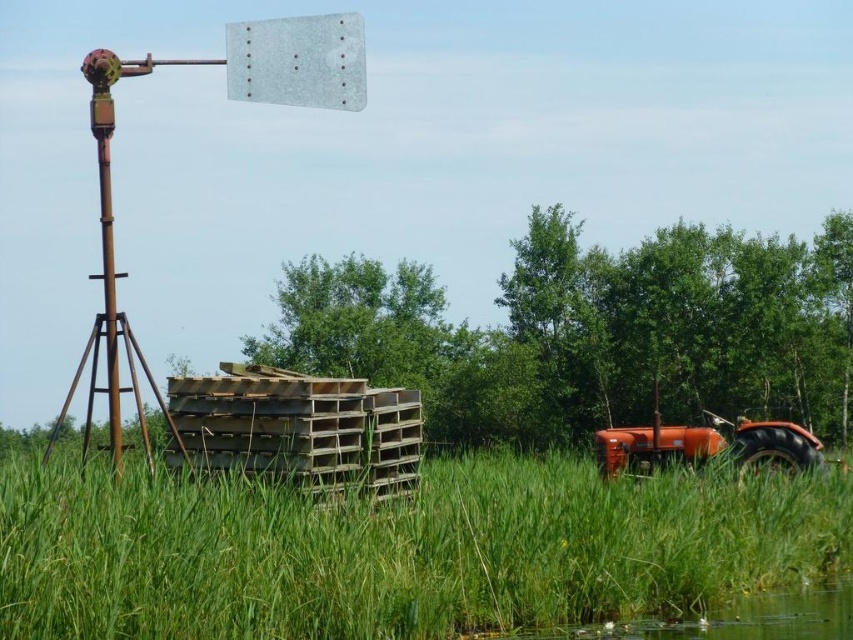
Question: Is green grassy at center wider than orange matte tractor at lower right?

Choices:
 (A) yes
 (B) no

Answer: (A)

Question: Which object is farther from the camera taking this photo?

Choices:
 (A) green grassy at center
 (B) orange matte tractor at lower right

Answer: (B)

Question: Which object appears closest to the camera in this image?

Choices:
 (A) green grassy at center
 (B) orange matte tractor at lower right

Answer: (A)

Question: Which of the following is the farthest from the observer?

Choices:
 (A) orange matte tractor at lower right
 (B) green grassy at center

Answer: (A)

Question: Does green grassy at center appear under orange matte tractor at lower right?

Choices:
 (A) no
 (B) yes

Answer: (B)

Question: Is green grassy at center to the left of orange matte tractor at lower right from the viewer's perspective?

Choices:
 (A) no
 (B) yes

Answer: (B)